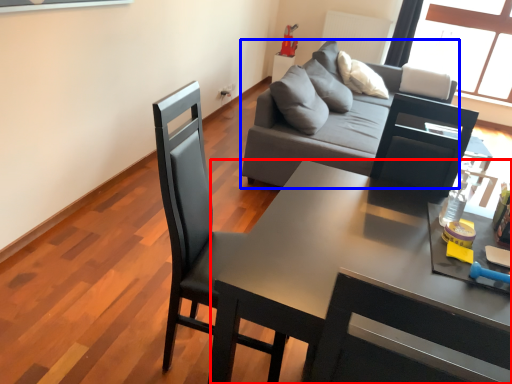
Question: Which object appears closest to the camera in this image, desk (highlighted by a red box) or studio couch (highlighted by a blue box)?

Choices:
 (A) desk
 (B) studio couch

Answer: (A)